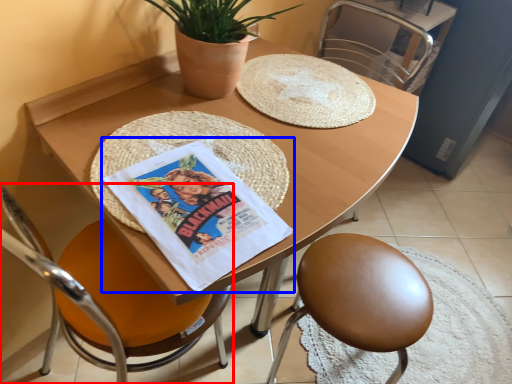
Question: Which object appears closest to the camera in this image, chair (highlighted by a red box) or comic book (highlighted by a blue box)?

Choices:
 (A) chair
 (B) comic book

Answer: (A)